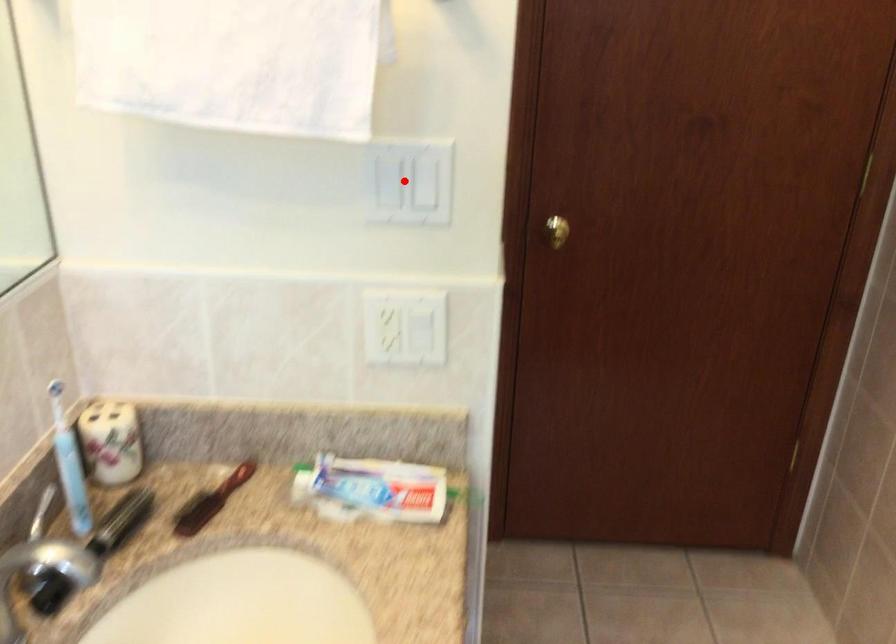
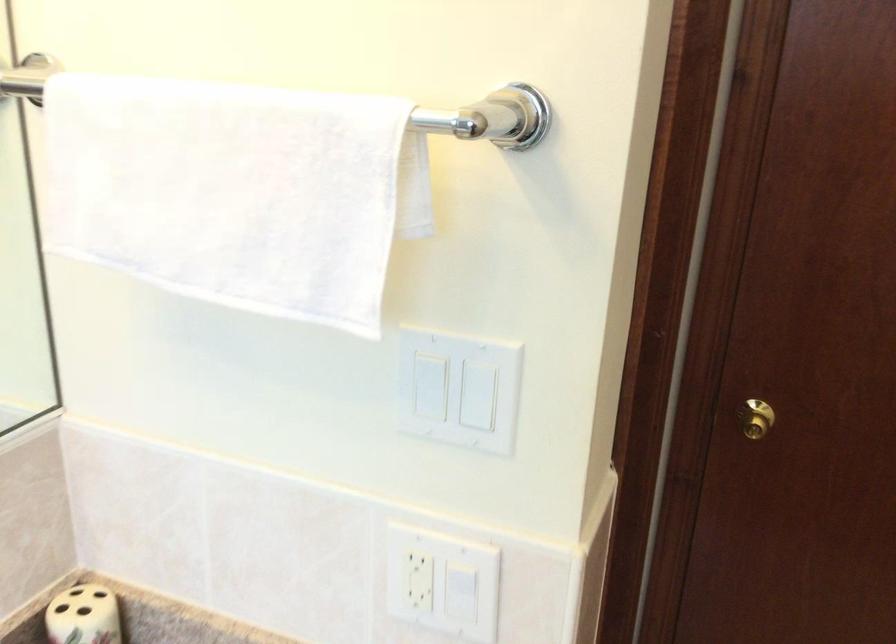
In the second image, find the point that corresponds to the highlighted location in the first image.

(458, 389)